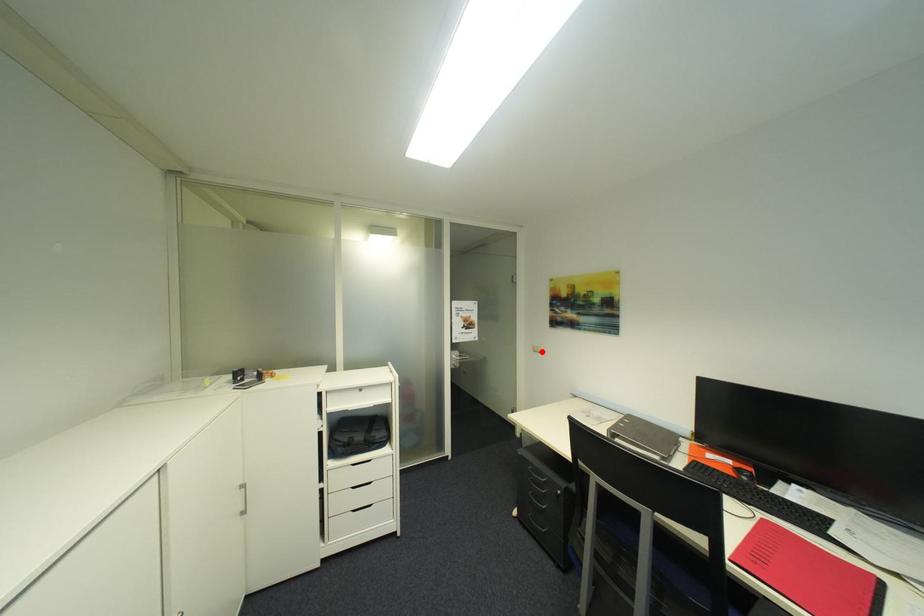
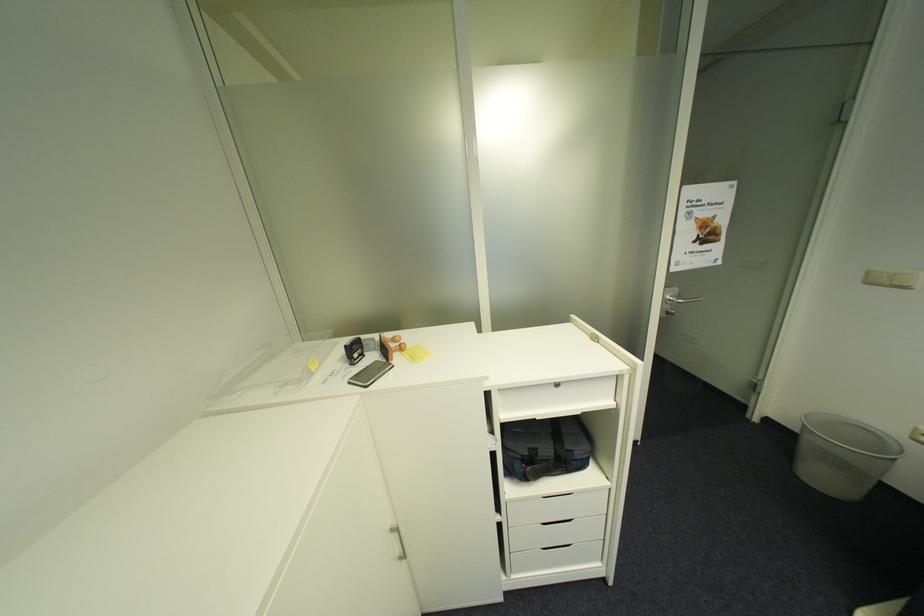
Locate, in the second image, the point that corresponds to the highlighted location in the first image.

(876, 284)